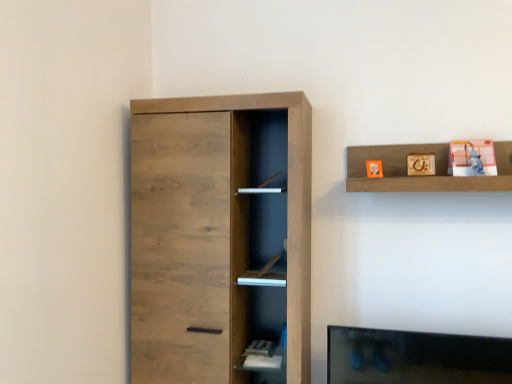
Question: Can you confirm if wooden shelf at upper right is positioned to the right of matte plastic photo frame at upper right, the first toy when ordered from right to left?

Choices:
 (A) yes
 (B) no

Answer: (B)

Question: Does wooden shelf at upper right have a greater height compared to matte plastic photo frame at upper right, the first toy when ordered from right to left?

Choices:
 (A) no
 (B) yes

Answer: (B)

Question: Is wooden shelf at upper right turned away from matte plastic photo frame at upper right, the first toy when ordered from right to left?

Choices:
 (A) no
 (B) yes

Answer: (B)

Question: Can you confirm if wooden shelf at upper right is shorter than matte plastic photo frame at upper right, the first toy when ordered from right to left?

Choices:
 (A) yes
 (B) no

Answer: (B)

Question: From a real-world perspective, is wooden shelf at upper right over matte plastic photo frame at upper right, the first toy when ordered from right to left?

Choices:
 (A) no
 (B) yes

Answer: (A)

Question: Would you say matte orange cube at upper center, arranged as the first toy when viewed from the left, is to the left or to the right of matte plastic photo frame at upper right, positioned as the second toy in left-to-right order, in the picture?

Choices:
 (A) right
 (B) left

Answer: (B)

Question: Considering their positions, is matte orange cube at upper center, arranged as the first toy when viewed from the left, located in front of or behind matte plastic photo frame at upper right, positioned as the second toy in left-to-right order?

Choices:
 (A) behind
 (B) front

Answer: (A)

Question: From the image's perspective, is matte orange cube at upper center, arranged as the first toy when viewed from the left, located above or below matte plastic photo frame at upper right, the first toy when ordered from right to left?

Choices:
 (A) above
 (B) below

Answer: (B)

Question: Considering the positions of matte orange cube at upper center, which is the second toy in right-to-left order, and matte plastic photo frame at upper right, positioned as the second toy in left-to-right order, in the image, is matte orange cube at upper center, which is the second toy in right-to-left order, taller or shorter than matte plastic photo frame at upper right, positioned as the second toy in left-to-right order,?

Choices:
 (A) short
 (B) tall

Answer: (A)

Question: Is wooden shelf at upper right to the left or to the right of matte plastic photo frame at upper right, positioned as the second toy in left-to-right order, in the image?

Choices:
 (A) right
 (B) left

Answer: (B)

Question: Does point (354, 178) appear closer or farther from the camera than point (482, 168)?

Choices:
 (A) farther
 (B) closer

Answer: (A)

Question: In the image, is wooden shelf at upper right positioned in front of or behind matte plastic photo frame at upper right, the first toy when ordered from right to left?

Choices:
 (A) front
 (B) behind

Answer: (A)

Question: From the image's perspective, is wooden shelf at upper right located above or below matte plastic photo frame at upper right, positioned as the second toy in left-to-right order?

Choices:
 (A) below
 (B) above

Answer: (A)

Question: From the image's perspective, relative to natural wood cupboard at left, is matte plastic photo frame at upper right, positioned as the second toy in left-to-right order, above or below?

Choices:
 (A) above
 (B) below

Answer: (A)

Question: Considering the positions of matte plastic photo frame at upper right, positioned as the second toy in left-to-right order, and natural wood cupboard at left in the image, is matte plastic photo frame at upper right, positioned as the second toy in left-to-right order, taller or shorter than natural wood cupboard at left?

Choices:
 (A) short
 (B) tall

Answer: (A)